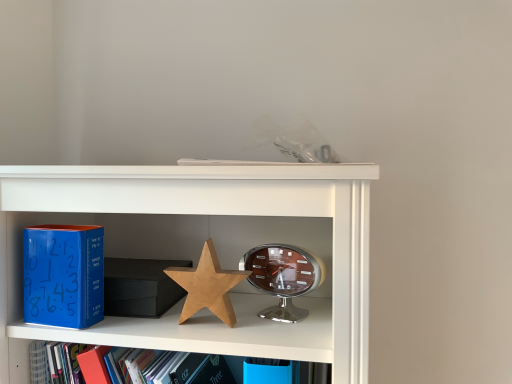
Question: Does blue matte clock at left have a smaller size compared to shiny silver alarm clock at center?

Choices:
 (A) no
 (B) yes

Answer: (B)

Question: Is blue matte clock at left to the right of shiny silver alarm clock at center from the viewer's perspective?

Choices:
 (A) no
 (B) yes

Answer: (A)

Question: Is blue matte clock at left shorter than shiny silver alarm clock at center?

Choices:
 (A) yes
 (B) no

Answer: (B)

Question: Is blue matte clock at left behind shiny silver alarm clock at center?

Choices:
 (A) no
 (B) yes

Answer: (A)

Question: Is blue matte clock at left outside of shiny silver alarm clock at center?

Choices:
 (A) no
 (B) yes

Answer: (B)

Question: From a real-world perspective, relative to wooden star at center, is shiny silver alarm clock at center vertically above or below?

Choices:
 (A) above
 (B) below

Answer: (B)

Question: Is shiny silver alarm clock at center situated inside wooden star at center or outside?

Choices:
 (A) inside
 (B) outside

Answer: (B)

Question: From the image's perspective, is shiny silver alarm clock at center located above or below wooden star at center?

Choices:
 (A) above
 (B) below

Answer: (B)

Question: Considering the positions of shiny silver alarm clock at center and wooden star at center in the image, is shiny silver alarm clock at center bigger or smaller than wooden star at center?

Choices:
 (A) big
 (B) small

Answer: (A)

Question: Is blue matte clock at left wider or thinner than shiny silver alarm clock at center?

Choices:
 (A) thin
 (B) wide

Answer: (A)

Question: Is blue matte clock at left taller or shorter than shiny silver alarm clock at center?

Choices:
 (A) short
 (B) tall

Answer: (B)

Question: From a real-world perspective, is blue matte clock at left above or below shiny silver alarm clock at center?

Choices:
 (A) above
 (B) below

Answer: (A)

Question: Visually, is blue matte clock at left positioned to the left or to the right of shiny silver alarm clock at center?

Choices:
 (A) left
 (B) right

Answer: (A)

Question: Which is correct: wooden star at center is inside blue matte clock at left, or outside of it?

Choices:
 (A) inside
 (B) outside

Answer: (B)

Question: Based on their positions, is wooden star at center located to the left or right of blue matte clock at left?

Choices:
 (A) left
 (B) right

Answer: (B)